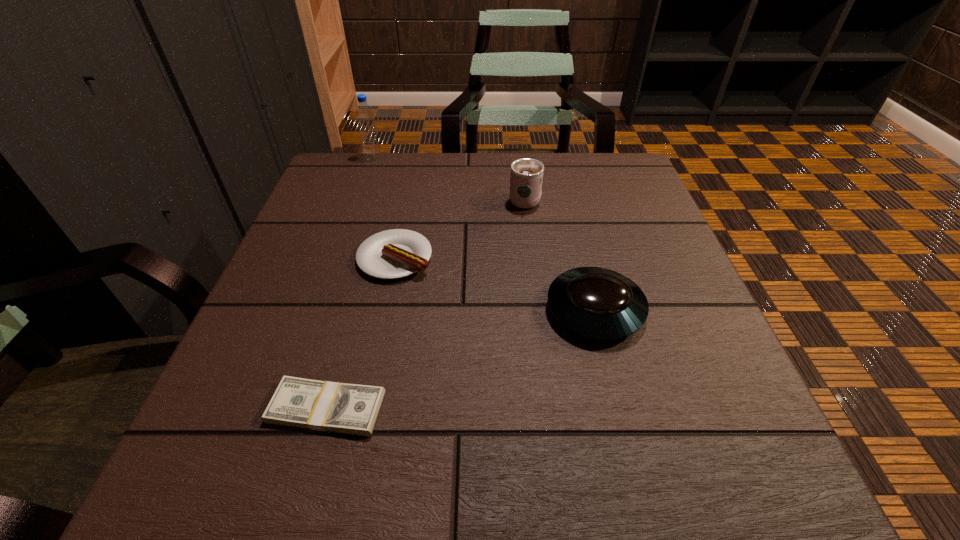
Image resolution: width=960 pixels, height=540 pixels. I want to click on vacant region that satisfies the following two spatial constraints: 1. on the front side of the water bottle; 2. on the right side of the saucer, so click(x=320, y=310).